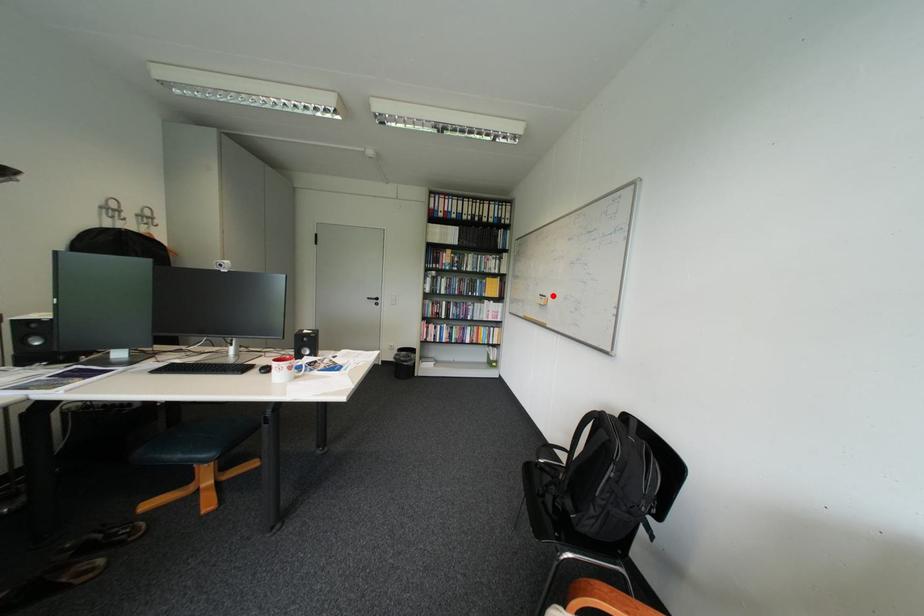
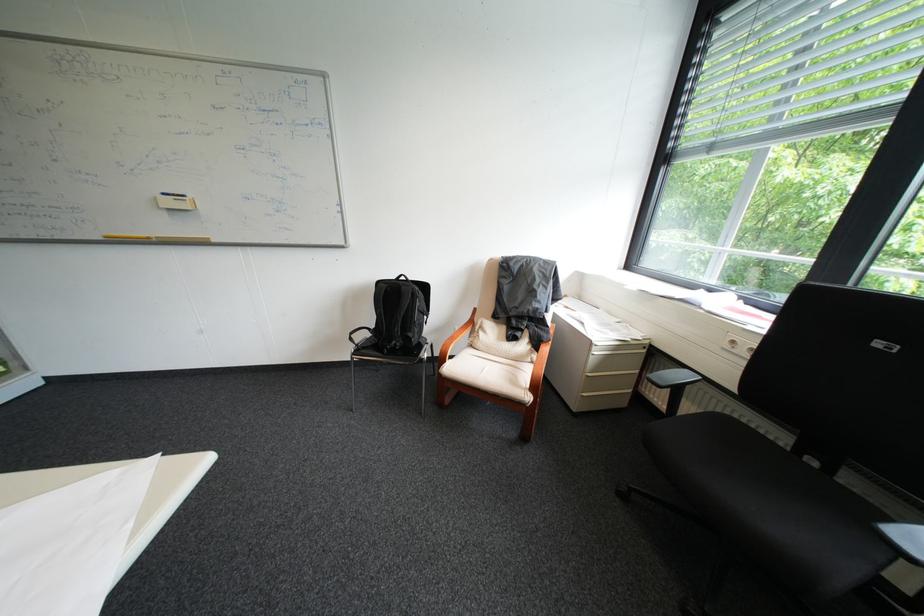
In the second image, find the point that corresponds to the highlighted location in the first image.

(176, 195)